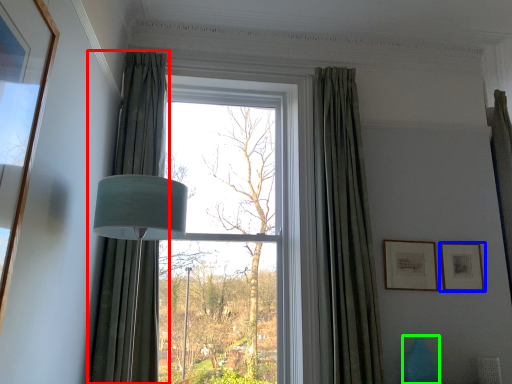
Question: Considering the real-world distances, which object is closest to curtain (highlighted by a red box)? picture frame (highlighted by a blue box) or vase (highlighted by a green box).

Choices:
 (A) picture frame
 (B) vase

Answer: (B)